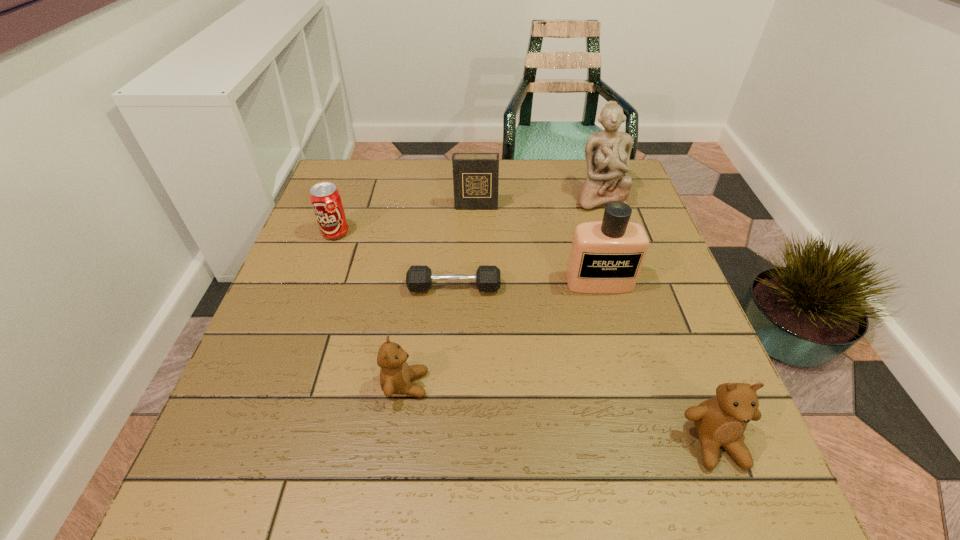
You are a GUI agent. You are given a task and a screenshot of the screen. Output one action in this format:
    pyautogui.click(x=<x>, y=<y>)
    Task: Click on the free space located on the front-facing side of the second nearest object
    This screenshot has height=540, width=960.
    Given the screenshot: What is the action you would take?
    pyautogui.click(x=614, y=384)

The image size is (960, 540). Find the location of `vacant space located on the front-facing side of the tallest object`. vacant space located on the front-facing side of the tallest object is located at coordinates (626, 280).

This screenshot has height=540, width=960. I want to click on vacant space located on the front of the leftmost object, so click(294, 349).

Where is `free location located on the front cover of the diary`? The width and height of the screenshot is (960, 540). free location located on the front cover of the diary is located at coordinates (475, 262).

The image size is (960, 540). In order to click on free space located on the front label of the sixth shortest object in this screenshot , I will do `click(618, 353)`.

Where is `vacant space located on the front of the shortest object`? This screenshot has width=960, height=540. vacant space located on the front of the shortest object is located at coordinates (449, 378).

Where is `figurine present at the far edge`? figurine present at the far edge is located at coordinates (607, 153).

I want to click on diary that is at the far edge, so click(475, 175).

Identify the location of object located in the left edge section of the desktop. (325, 198).

At what (x,y) coordinates should I click in order to perform the action: click on teddy bear situated at the right edge. Please return your answer as a coordinate pair (x, y). This screenshot has height=540, width=960. Looking at the image, I should click on (720, 421).